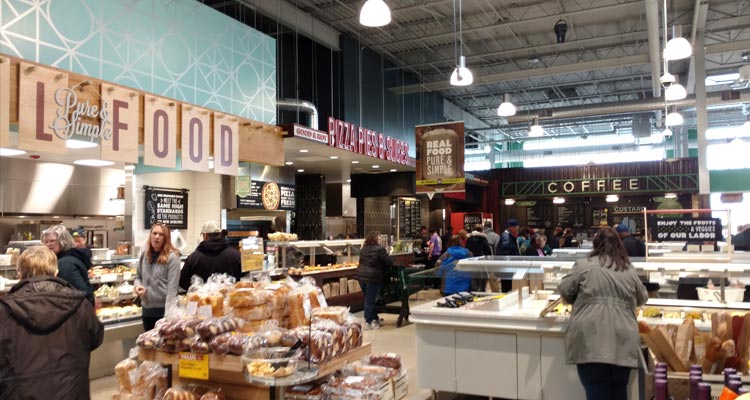
Find the location of a particular element. This screenshot has width=750, height=400. white tile floor in center is located at coordinates point(397,337), point(376,340).